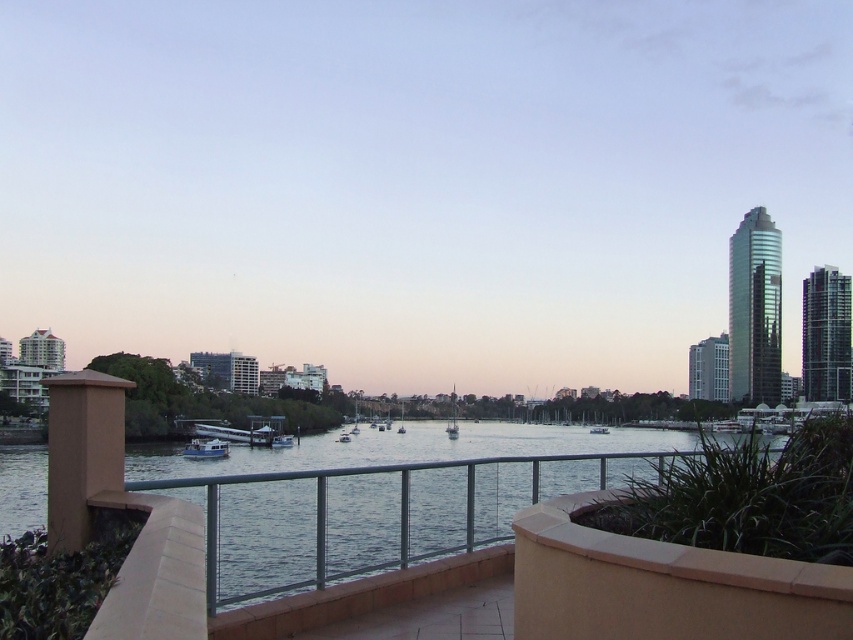
Question: In this image, where is clear water at center located relative to white glossy boat at center?

Choices:
 (A) above
 (B) below

Answer: (B)

Question: Which point is closer to the camera taking this photo?

Choices:
 (A) (207, 442)
 (B) (390, 525)

Answer: (B)

Question: Does clear water at center have a smaller size compared to white glossy boat at center?

Choices:
 (A) no
 (B) yes

Answer: (A)

Question: Which point is closer to the camera?

Choices:
 (A) clear water at center
 (B) metallic blue boat at center
 (C) white glossy boat at center

Answer: (A)

Question: Does clear water at center appear over white glossy boat at center?

Choices:
 (A) no
 (B) yes

Answer: (A)

Question: Which point is farther to the camera?

Choices:
 (A) (196, 451)
 (B) (393, 452)
 (C) (283, 444)

Answer: (B)